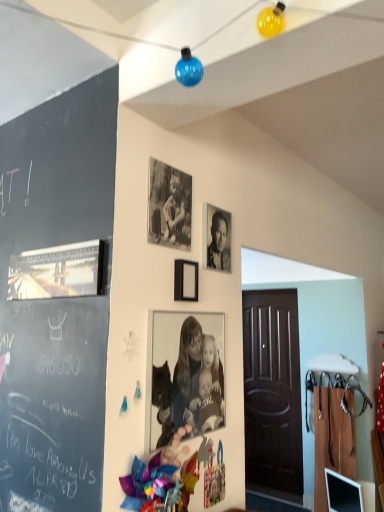
Question: Considering the relative positions of matte black picture frame at upper center, which is the first picture frame from right to left, and black and white photograph of people at center, which is the 1th person in bottom-to-top order, in the image provided, is matte black picture frame at upper center, which is the first picture frame from right to left, in front of black and white photograph of people at center, which is the 1th person in bottom-to-top order,?

Choices:
 (A) yes
 (B) no

Answer: (B)

Question: From a real-world perspective, does matte black picture frame at upper center, which is the first picture frame from right to left, stand above black and white photograph of people at center, which is the 1th person in bottom-to-top order?

Choices:
 (A) yes
 (B) no

Answer: (A)

Question: Is matte black picture frame at upper center, which is the first picture frame from right to left, wider than black and white photograph of people at center, which is the 1th person in bottom-to-top order?

Choices:
 (A) yes
 (B) no

Answer: (A)

Question: From the image's perspective, would you say matte black picture frame at upper center, which is the first picture frame from right to left, is shown under black and white photograph of people at center, which ranks as the 2th person in top-to-bottom order?

Choices:
 (A) no
 (B) yes

Answer: (A)

Question: Does matte black picture frame at upper center, arranged as the third picture frame when viewed from the left, have a larger size compared to black and white photograph of people at center, which is the 1th person in bottom-to-top order?

Choices:
 (A) yes
 (B) no

Answer: (B)

Question: Is matte black picture frame at upper center, which is the first picture frame from right to left, not within black and white photograph of people at center, which ranks as the 2th person in top-to-bottom order?

Choices:
 (A) yes
 (B) no

Answer: (A)

Question: From a real-world perspective, is matte black picture frame at upper center, which is the first picture frame from right to left, positioned under black matte photo frame at center, the second picture frame positioned from the right, based on gravity?

Choices:
 (A) no
 (B) yes

Answer: (B)

Question: Can you confirm if matte black picture frame at upper center, arranged as the third picture frame when viewed from the left, is shorter than black matte photo frame at center, which is counted as the 2th picture frame, starting from the left?

Choices:
 (A) yes
 (B) no

Answer: (A)

Question: Is matte black picture frame at upper center, which is the first picture frame from right to left, turned away from black matte photo frame at center, the second picture frame positioned from the right?

Choices:
 (A) no
 (B) yes

Answer: (A)

Question: Is matte black picture frame at upper center, arranged as the third picture frame when viewed from the left, thinner than black matte photo frame at center, the second picture frame positioned from the right?

Choices:
 (A) yes
 (B) no

Answer: (B)

Question: Is the position of matte black picture frame at upper center, arranged as the third picture frame when viewed from the left, more distant than that of black matte photo frame at center, which is counted as the 2th picture frame, starting from the left?

Choices:
 (A) no
 (B) yes

Answer: (B)

Question: Does matte black picture frame at upper center, which is the first picture frame from right to left, appear on the right side of black matte photo frame at center, the second picture frame positioned from the right?

Choices:
 (A) yes
 (B) no

Answer: (A)

Question: Does black matte photo frame at center, which is counted as the 2th picture frame, starting from the left, have a larger size compared to matte black picture frame at upper center, arranged as the third picture frame when viewed from the left?

Choices:
 (A) yes
 (B) no

Answer: (A)